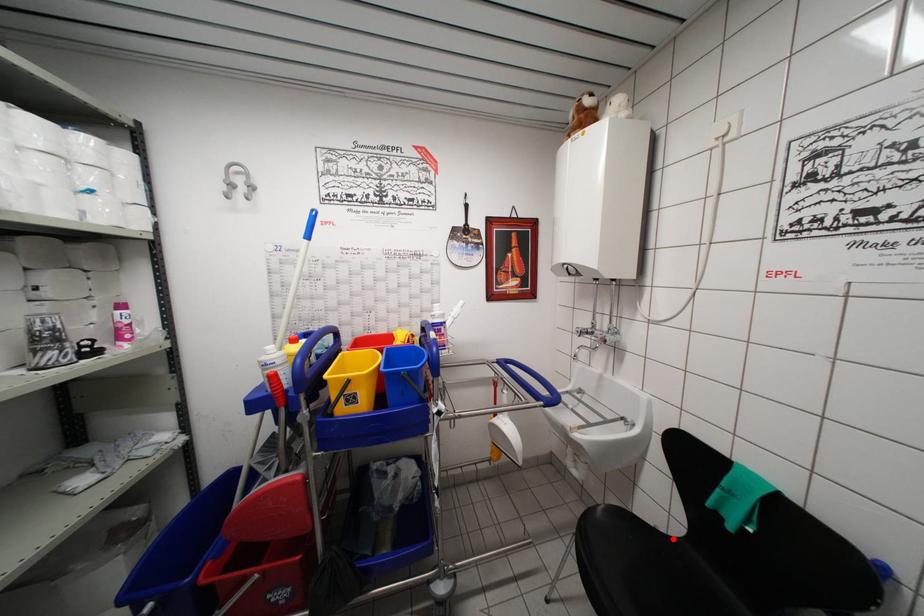
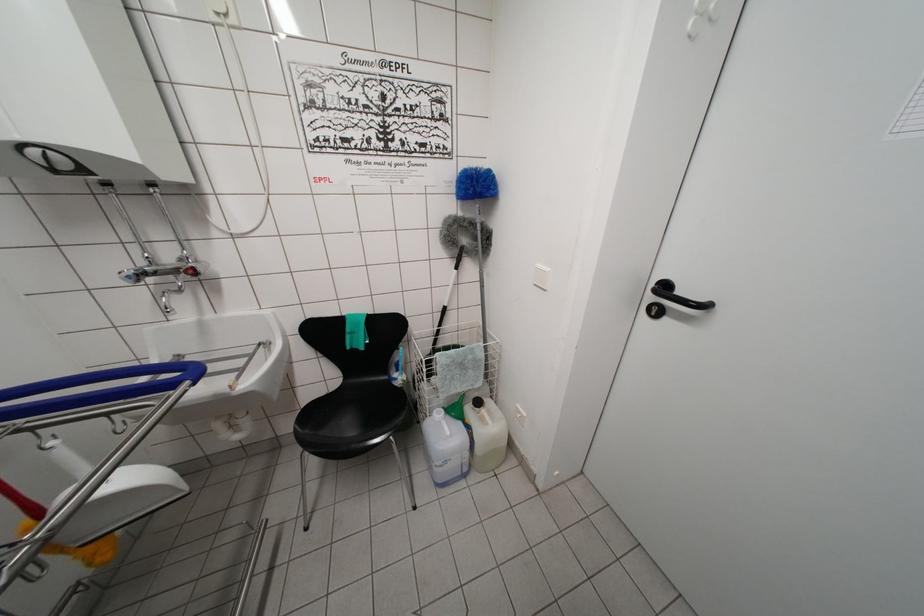
Question: I am providing you with two images of the same scene from different viewpoints. A red point is shown in image1. For the corresponding object point in image2, is it positioned nearer or farther from the camera?

Choices:
 (A) Nearer
 (B) Farther

Answer: (B)